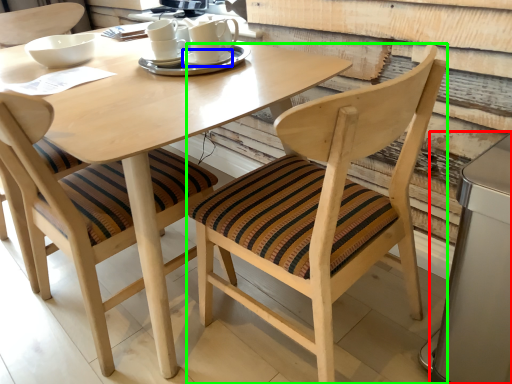
Question: Which object is the farthest from appliance (highlighted by a red box)? Choose among these: saucer (highlighted by a blue box) or chair (highlighted by a green box).

Choices:
 (A) saucer
 (B) chair

Answer: (A)